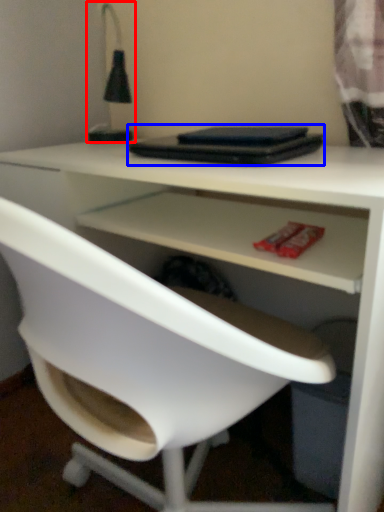
Question: Which point is closer to the camera, table lamp (highlighted by a red box) or laptop (highlighted by a blue box)?

Choices:
 (A) table lamp
 (B) laptop

Answer: (B)